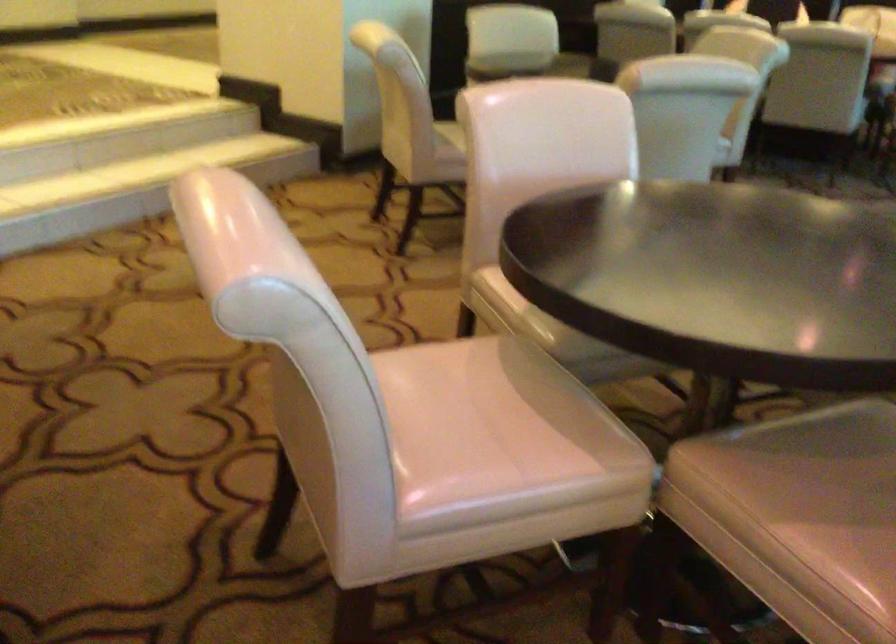
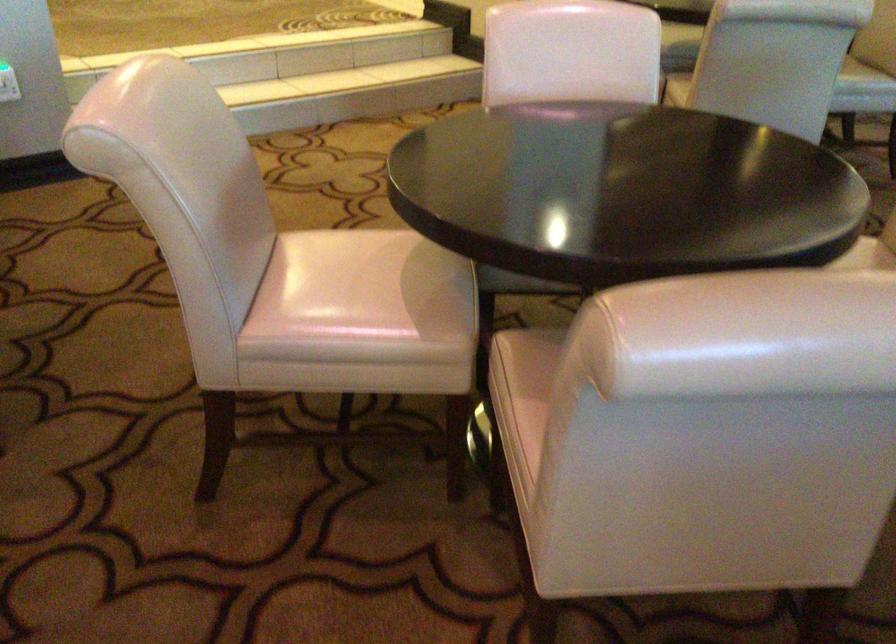
Find the pixel in the second image that matches point (738, 466) in the first image.

(538, 351)